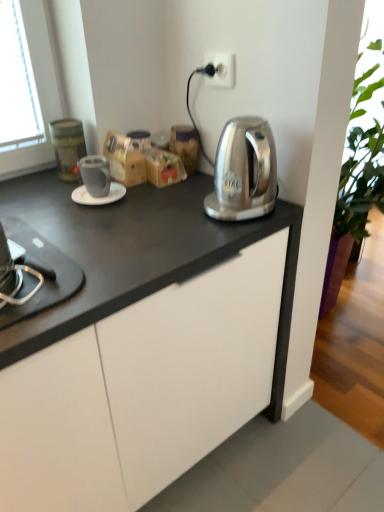
The height and width of the screenshot is (512, 384). In order to click on free space in front of brown paper bag at center, arranged as the first cabinetry when viewed from the back in this screenshot , I will do `click(155, 207)`.